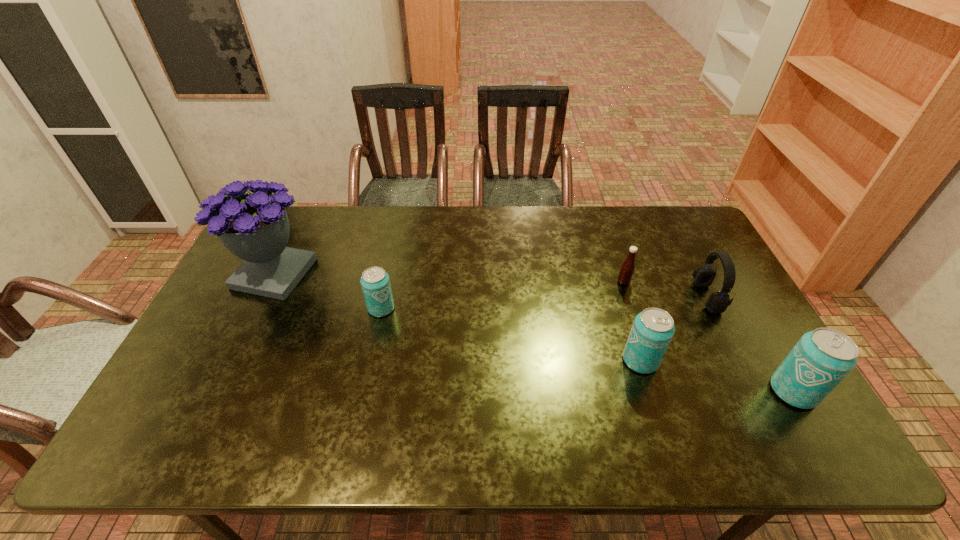
Please point a location where one more beer_can can be added evenly. Please provide its 2D coordinates. Your answer should be formatted as a tuple, i.e. [(x, y)], where the tuple contains the x and y coordinates of a point satisfying the conditions above.

[(504, 333)]